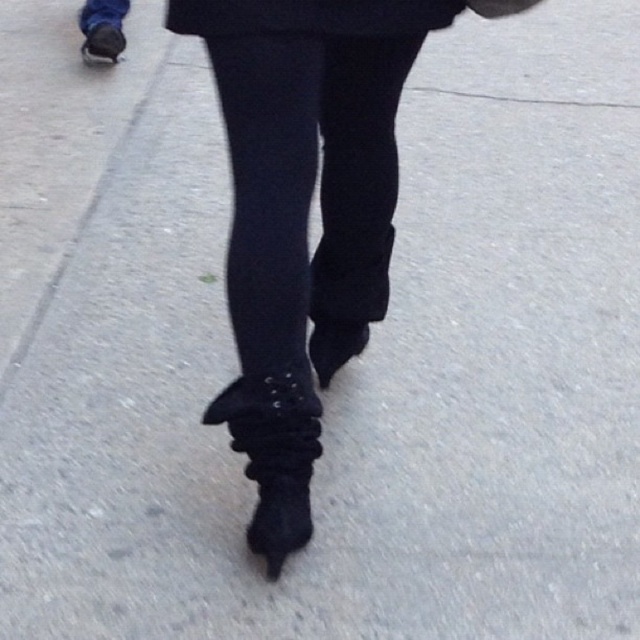
Which is more to the right, black smooth tights at center or black suede boot at lower center?

black smooth tights at center is more to the right.

Who is shorter, black smooth tights at center or black suede boot at lower center?

Standing shorter between the two is black suede boot at lower center.

Which is behind, point (257, 276) or point (266, 545)?

The point (266, 545) is more distant.

In order to click on black smooth tights at center in this screenshot , I will do `click(307, 186)`.

How distant is black smooth tights at center from black matte coat at upper center?

black smooth tights at center is 30.28 centimeters from black matte coat at upper center.

Is point (340, 116) behind point (417, 17)?

Yes, point (340, 116) is behind point (417, 17).

Who is more distant from viewer, (236,237) or (403,29)?

Positioned behind is point (236,237).

Locate an element on the screen. The width and height of the screenshot is (640, 640). black smooth tights at center is located at coordinates (307, 186).

Measure the distance from black suede boot at lower center to black matte coat at upper center.

black suede boot at lower center and black matte coat at upper center are 33.98 inches apart.

Identify the location of black suede boot at lower center. The image size is (640, 640). (273, 456).

Does point (285, 515) come behind point (392, 20)?

Yes, point (285, 515) is behind point (392, 20).

Find the location of a particular element. This screenshot has width=640, height=640. black suede boot at lower center is located at coordinates click(273, 456).